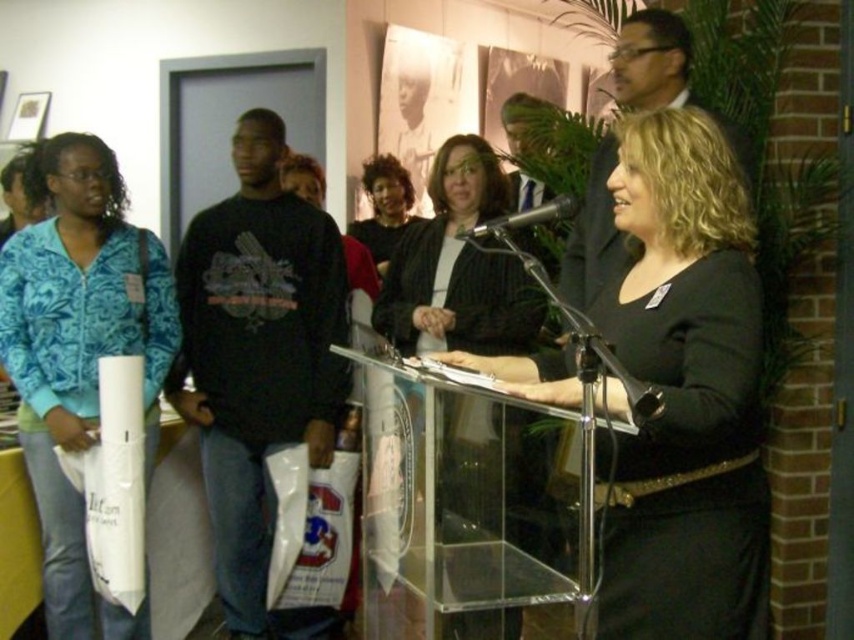
Who is shorter, black glossy dress at center or matte black podium at center?

matte black podium at center

Describe the element at coordinates (685, 392) in the screenshot. I see `black glossy dress at center` at that location.

The width and height of the screenshot is (854, 640). What do you see at coordinates (685, 392) in the screenshot?
I see `black glossy dress at center` at bounding box center [685, 392].

You are a GUI agent. You are given a task and a screenshot of the screen. Output one action in this format:
    pyautogui.click(x=<x>, y=<y>)
    Task: Click on the black glossy dress at center
    The width and height of the screenshot is (854, 640).
    Given the screenshot: What is the action you would take?
    pyautogui.click(x=685, y=392)

What do you see at coordinates (384, 209) in the screenshot?
I see `matte black sweater at center` at bounding box center [384, 209].

Who is taller, matte black sweater at center or metallic silver microphone at center?

matte black sweater at center

At what (x,y) coordinates should I click in order to perform the action: click on matte black sweater at center. Please return your answer as a coordinate pair (x, y). The width and height of the screenshot is (854, 640). Looking at the image, I should click on (384, 209).

You are a GUI agent. You are given a task and a screenshot of the screen. Output one action in this format:
    pyautogui.click(x=<x>, y=<y>)
    Task: Click on the matte black sweater at center
    The image size is (854, 640).
    Given the screenshot: What is the action you would take?
    pyautogui.click(x=384, y=209)

Which of these two, black cotton sweatshirt at left or matte black podium at center, stands taller?

black cotton sweatshirt at left

Is the position of black cotton sweatshirt at left more distant than that of matte black podium at center?

Yes, black cotton sweatshirt at left is behind matte black podium at center.

Which is in front, point (309, 330) or point (428, 330)?

Point (428, 330) is more forward.

Locate an element on the screen. This screenshot has height=640, width=854. black cotton sweatshirt at left is located at coordinates (259, 362).